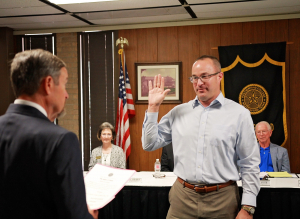
Find the location of a particular element. This screenshot has width=300, height=219. picture is located at coordinates (168, 72).